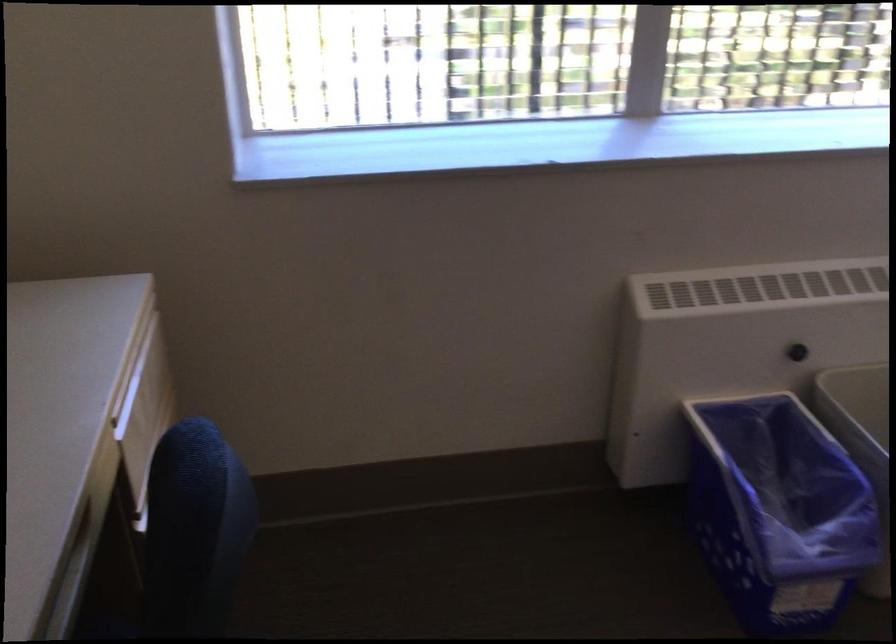
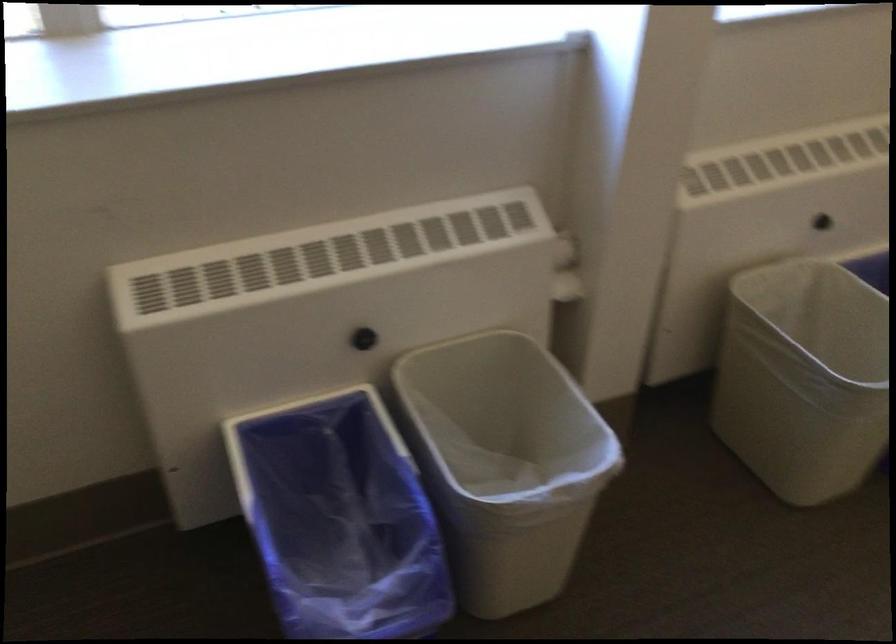
Where in the second image is the point corresponding to (x=761, y=489) from the first image?

(339, 518)